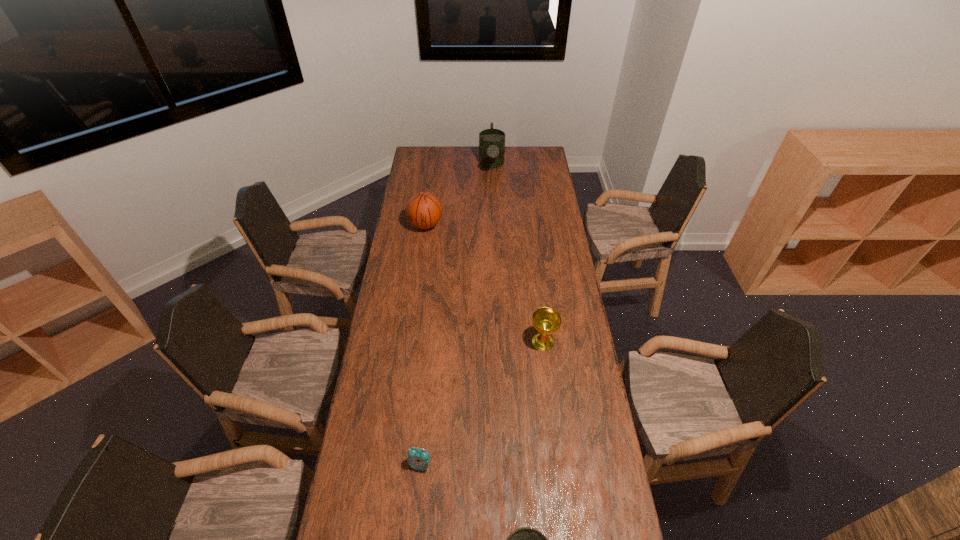
Locate an element on the screen. free space located on the face of the fourth farthest object is located at coordinates (416, 515).

Locate an element on the screen. object present at the far edge is located at coordinates (491, 141).

Image resolution: width=960 pixels, height=540 pixels. What are the coordinates of `object that is at the left edge` in the screenshot? It's located at (423, 210).

Identify the location of object that is at the right edge. (546, 321).

Identify the location of vacant space at the far edge of the desktop. The width and height of the screenshot is (960, 540). (450, 161).

Locate an element on the screen. The image size is (960, 540). vacant space at the left edge is located at coordinates (428, 173).

Locate an element on the screen. The height and width of the screenshot is (540, 960). vacant region at the right edge of the desktop is located at coordinates (569, 474).

Identify the location of vacant space at the far right corner. Image resolution: width=960 pixels, height=540 pixels. (535, 148).

I want to click on vacant area between the basketball and the rightmost object, so click(x=484, y=284).

At what (x,y) coordinates should I click in order to perform the action: click on empty space between the alarm clock and the second farthest object. Please return your answer as a coordinate pair (x, y). Looking at the image, I should click on (422, 345).